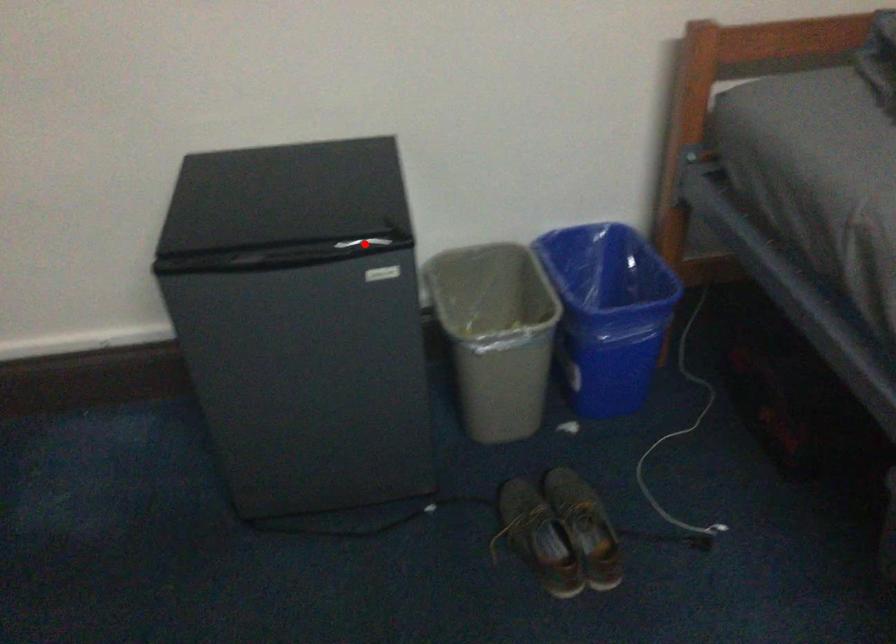
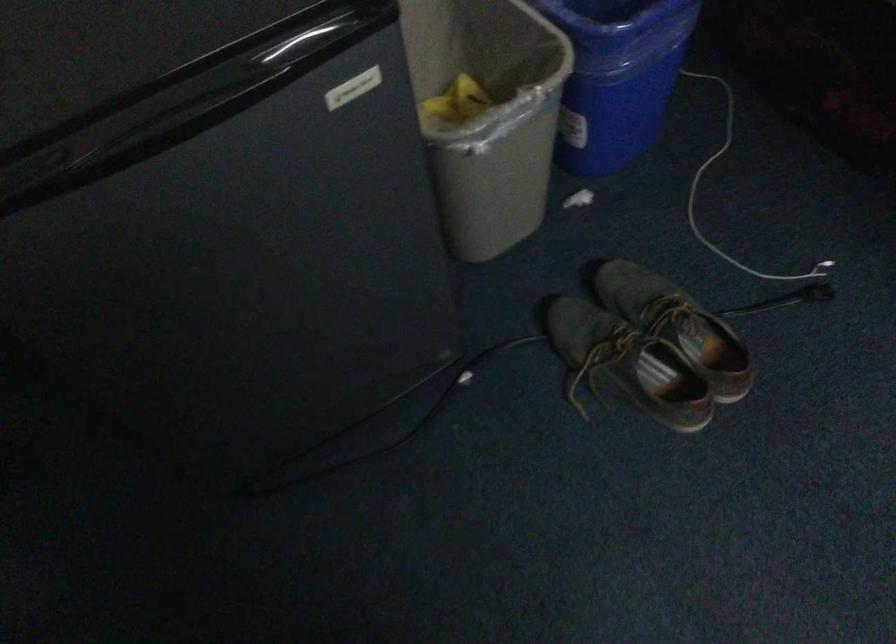
Question: I am providing you with two images of the same scene from different viewpoints. In image1, a red point is highlighted. Considering the same 3D point in image2, which of the following is correct?

Choices:
 (A) It is closer
 (B) It is farther

Answer: (A)